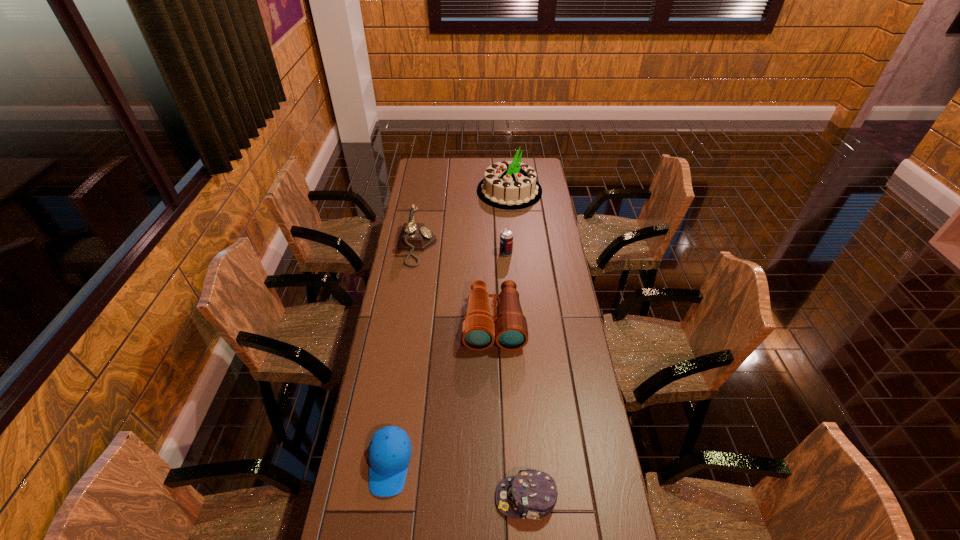
I want to click on vacant space located 0.110m on the back of the beer can, so pyautogui.click(x=505, y=233).

Locate an element on the screen. Image resolution: width=960 pixels, height=540 pixels. blank space located on the front-facing side of the left headwear is located at coordinates (380, 526).

In order to click on blank space located on the front-facing side of the right headwear in this screenshot , I will do `click(408, 498)`.

I want to click on vacant space located 0.130m on the front-facing side of the right headwear, so click(448, 498).

What are the coordinates of `blank space located on the front-facing side of the right headwear` in the screenshot? It's located at (477, 498).

In order to click on object at the far edge in this screenshot , I will do `click(511, 185)`.

Find the location of a particular element. telephone located in the left edge section of the desktop is located at coordinates (414, 236).

Where is `cap that is positioned at the left edge`? The height and width of the screenshot is (540, 960). cap that is positioned at the left edge is located at coordinates (389, 453).

Locate an element on the screen. birthday cake present at the right edge is located at coordinates (511, 185).

Where is `headwear positioned at the right edge`? Image resolution: width=960 pixels, height=540 pixels. headwear positioned at the right edge is located at coordinates (532, 494).